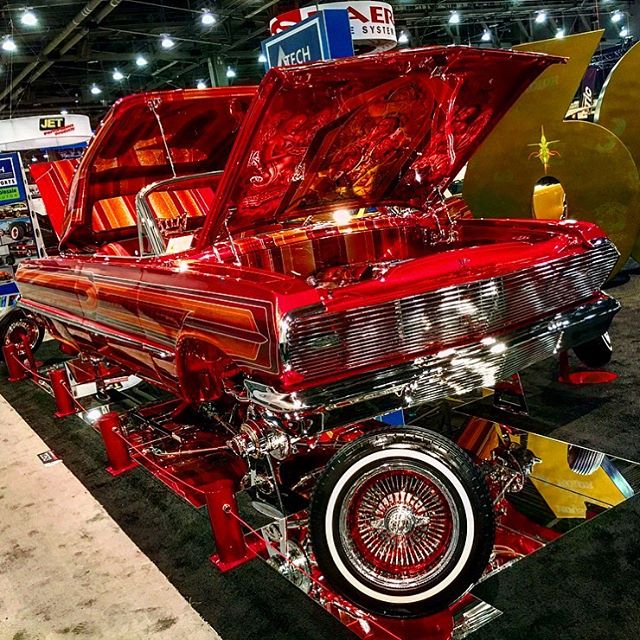
I want to click on cover, so click(172, 128).